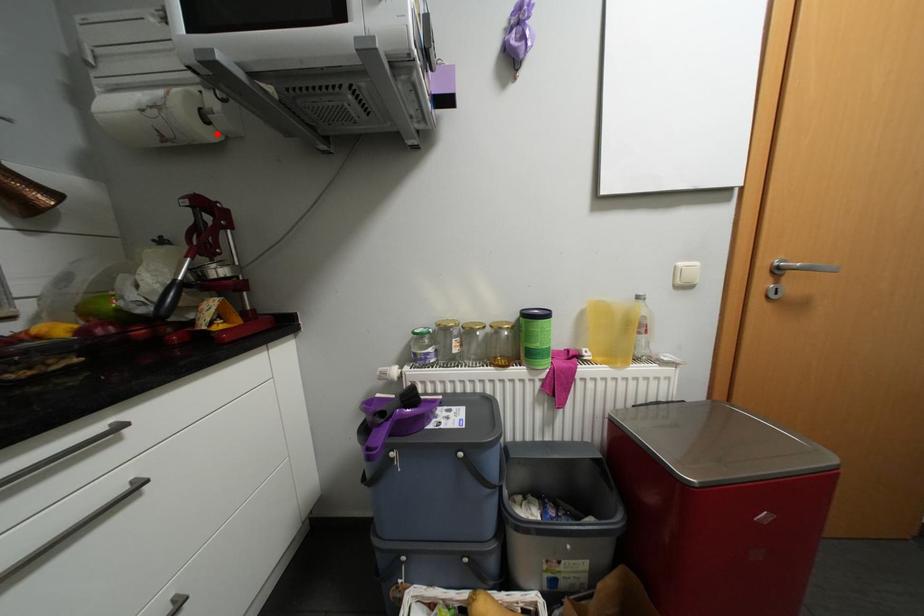
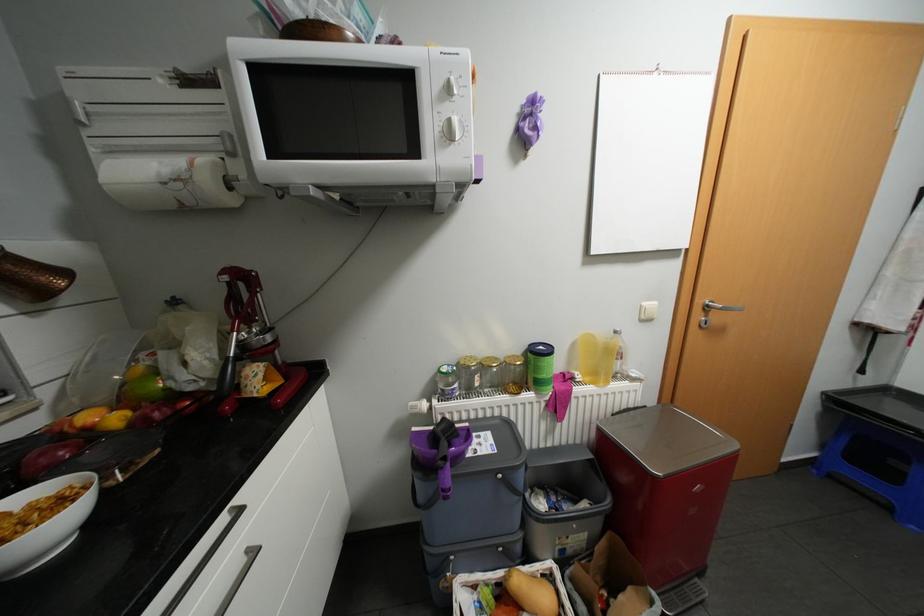
In the second image, find the point that corresponds to the highlighted location in the first image.

(239, 199)